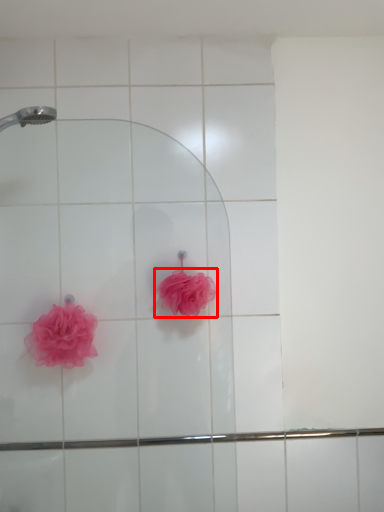
Question: From the image's perspective, where is rose (annotated by the red box) located relative to rose?

Choices:
 (A) below
 (B) above

Answer: (B)